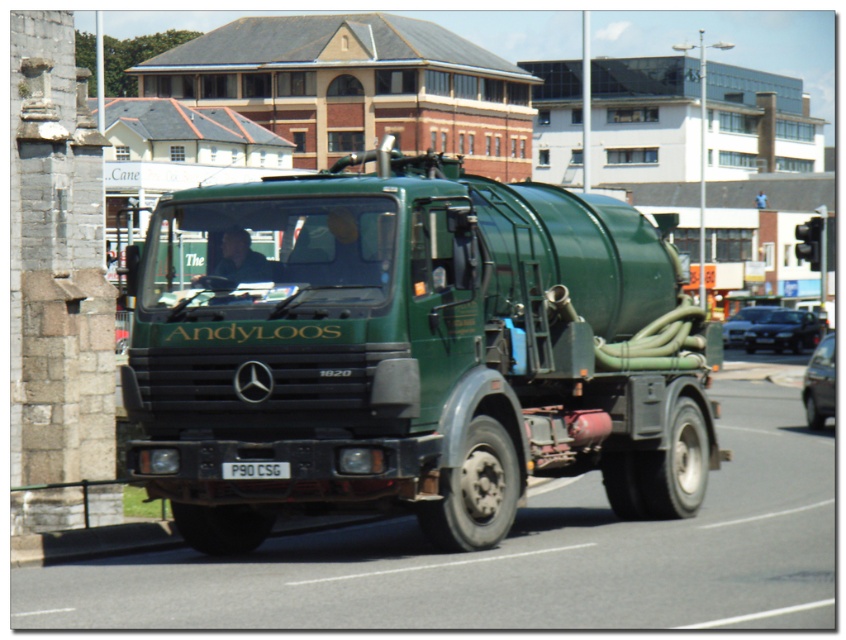
Consider the image. Can you confirm if green matte truck at center is bigger than white plastic license plate at center?

Indeed, green matte truck at center has a larger size compared to white plastic license plate at center.

Who is more distant from viewer, (526, 218) or (279, 477)?

The point (526, 218) is behind.

Where is `green matte truck at center`? green matte truck at center is located at coordinates (410, 352).